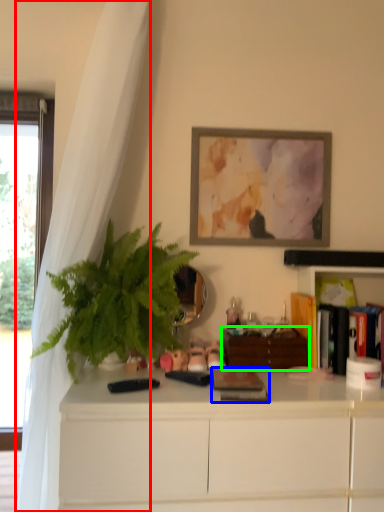
Question: Based on their relative distances, which object is nearer to curtain (highlighted by a red box)? Choose from book (highlighted by a blue box) and file cabinet (highlighted by a green box).

Choices:
 (A) book
 (B) file cabinet

Answer: (A)